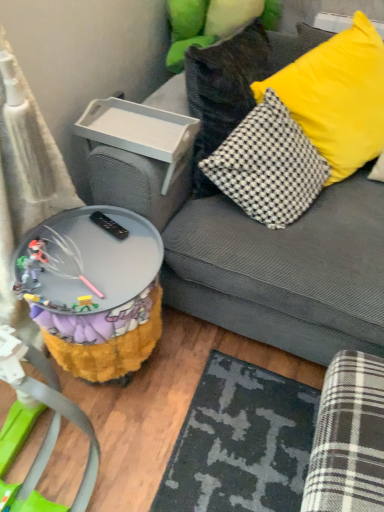
Question: Is fuzzy fabric table at lower left thinner than gray fabric couch at upper right?

Choices:
 (A) no
 (B) yes

Answer: (B)

Question: From a real-world perspective, is fuzzy fabric table at lower left located higher than gray fabric couch at upper right?

Choices:
 (A) no
 (B) yes

Answer: (A)

Question: Is fuzzy fabric table at lower left oriented towards gray fabric couch at upper right?

Choices:
 (A) no
 (B) yes

Answer: (A)

Question: Is fuzzy fabric table at lower left at the left side of gray fabric couch at upper right?

Choices:
 (A) no
 (B) yes

Answer: (B)

Question: Is fuzzy fabric table at lower left not within gray fabric couch at upper right?

Choices:
 (A) no
 (B) yes

Answer: (B)

Question: From a real-world perspective, is fuzzy fabric table at lower left physically located above or below white plastic tray at upper left?

Choices:
 (A) below
 (B) above

Answer: (A)

Question: Choose the correct answer: Is fuzzy fabric table at lower left inside white plastic tray at upper left or outside it?

Choices:
 (A) inside
 (B) outside

Answer: (B)

Question: Considering the positions of point (84, 313) and point (167, 188), is point (84, 313) closer or farther from the camera than point (167, 188)?

Choices:
 (A) closer
 (B) farther

Answer: (A)

Question: Based on their positions, is fuzzy fabric table at lower left located to the left or right of white plastic tray at upper left?

Choices:
 (A) right
 (B) left

Answer: (B)

Question: From the image's perspective, is yellow fabric pillow at upper right positioned above or below white plastic tray at upper left?

Choices:
 (A) above
 (B) below

Answer: (A)

Question: In the image, is yellow fabric pillow at upper right positioned in front of or behind white plastic tray at upper left?

Choices:
 (A) behind
 (B) front

Answer: (B)

Question: In the image, is yellow fabric pillow at upper right on the left side or the right side of white plastic tray at upper left?

Choices:
 (A) right
 (B) left

Answer: (A)

Question: Looking at their shapes, would you say yellow fabric pillow at upper right is wider or thinner than white plastic tray at upper left?

Choices:
 (A) thin
 (B) wide

Answer: (B)

Question: Is gray fabric couch at upper right spatially inside yellow fabric pillow at upper right, or outside of it?

Choices:
 (A) outside
 (B) inside

Answer: (A)

Question: In terms of height, does gray fabric couch at upper right look taller or shorter compared to yellow fabric pillow at upper right?

Choices:
 (A) short
 (B) tall

Answer: (B)